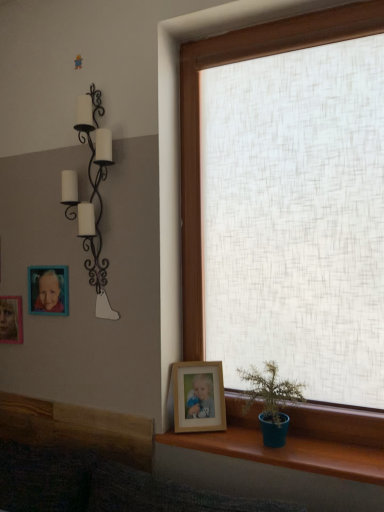
You are a GUI agent. You are given a task and a screenshot of the screen. Output one action in this format:
    pyautogui.click(x=<x>, y=<y>)
    Task: Click on the free space in front of wooden photo frame at lower center, which ranks as the third picture frame in back-to-front order
    The image size is (384, 512).
    Given the screenshot: What is the action you would take?
    pyautogui.click(x=205, y=436)